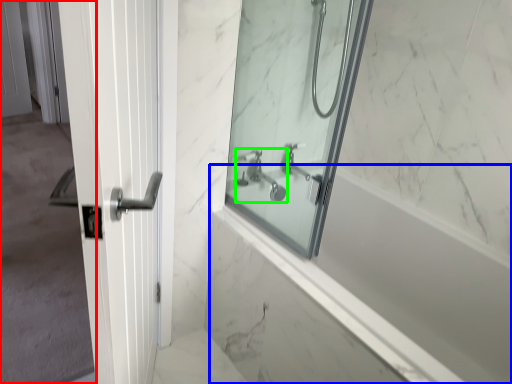
Question: Estimate the real-world distances between objects in this image. Which object is closer to screen door (highlighted by a red box), bath (highlighted by a blue box) or tap (highlighted by a green box)?

Choices:
 (A) bath
 (B) tap

Answer: (B)